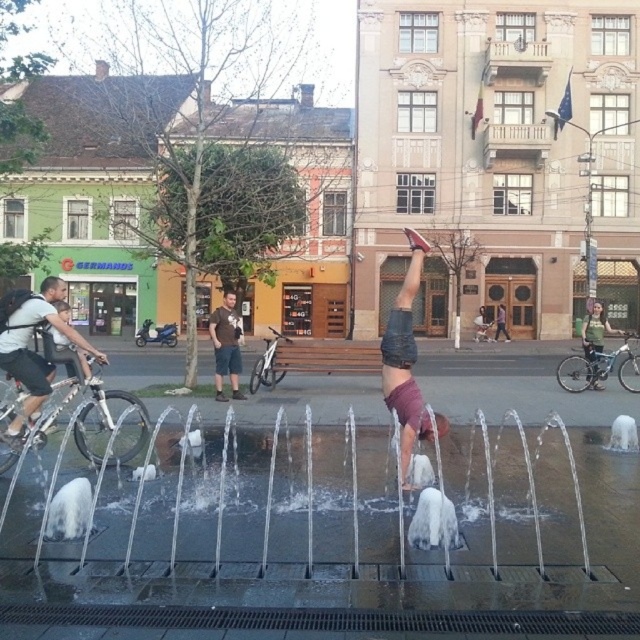
Question: Which object appears farthest from the camera in this image?

Choices:
 (A) matte black shorts at center
 (B) green fabric bag at lower right
 (C) dark gray shorts at center
 (D) dark brown cotton t-shirt at center

Answer: (C)

Question: Which object appears closest to the camera in this image?

Choices:
 (A) silver metallic bicycle at left
 (B) clear plastic water jets at center
 (C) silver metallic bicycle at center

Answer: (B)

Question: Does denim shorts at center have a greater width compared to green fabric bag at lower right?

Choices:
 (A) no
 (B) yes

Answer: (A)

Question: Can you confirm if clear plastic water jets at center is wider than dark gray shorts at center?

Choices:
 (A) yes
 (B) no

Answer: (B)

Question: Which object is the farthest from the clear plastic water jets at center?

Choices:
 (A) dark brown cotton t-shirt at center
 (B) matte black shorts at center
 (C) silver metallic bicycle at left

Answer: (B)

Question: Is silver metallic bicycle at left closer to camera compared to green fabric bag at lower right?

Choices:
 (A) yes
 (B) no

Answer: (A)